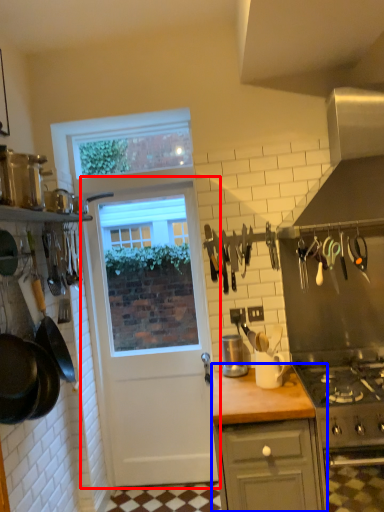
Question: Which object appears closest to the camera in this image, door (highlighted by a red box) or cabinetry (highlighted by a blue box)?

Choices:
 (A) door
 (B) cabinetry

Answer: (B)